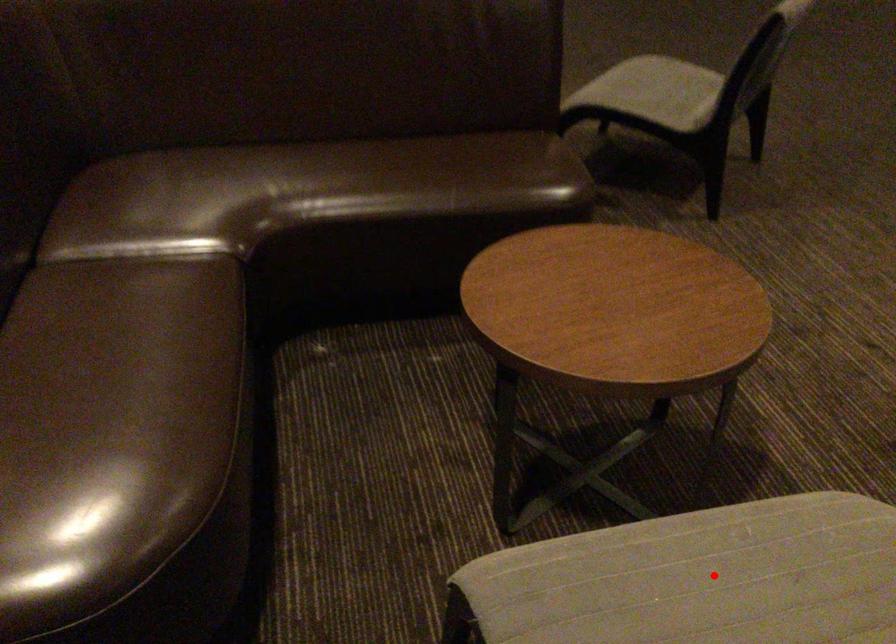
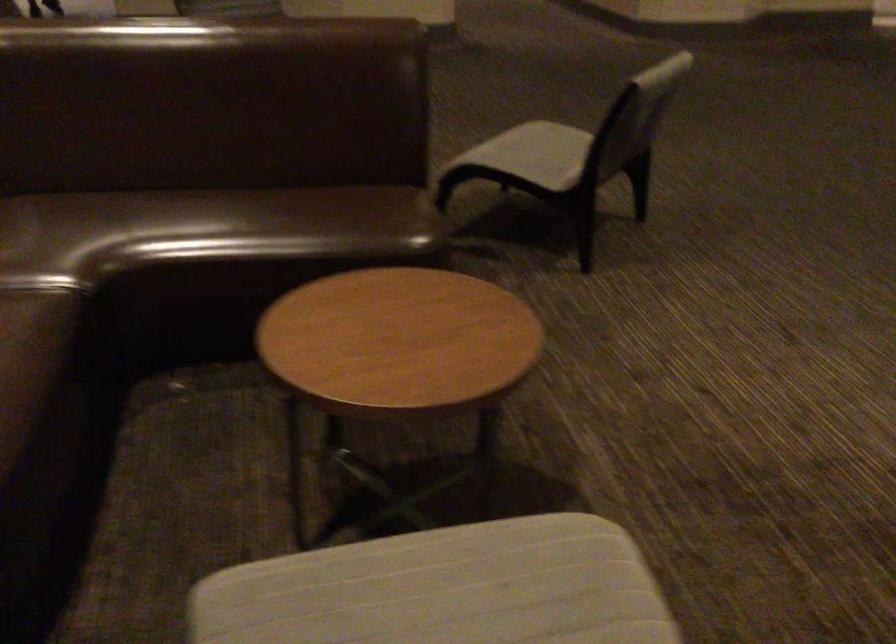
The point at the highlighted location is marked in the first image. Where is the corresponding point in the second image?

(444, 589)